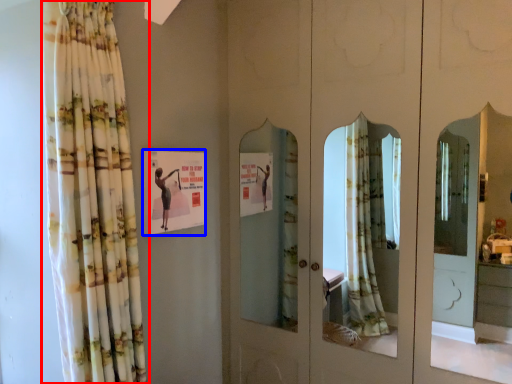
Question: Among these objects, which one is nearest to the camera, curtain (highlighted by a red box) or postcard (highlighted by a blue box)?

Choices:
 (A) curtain
 (B) postcard

Answer: (A)